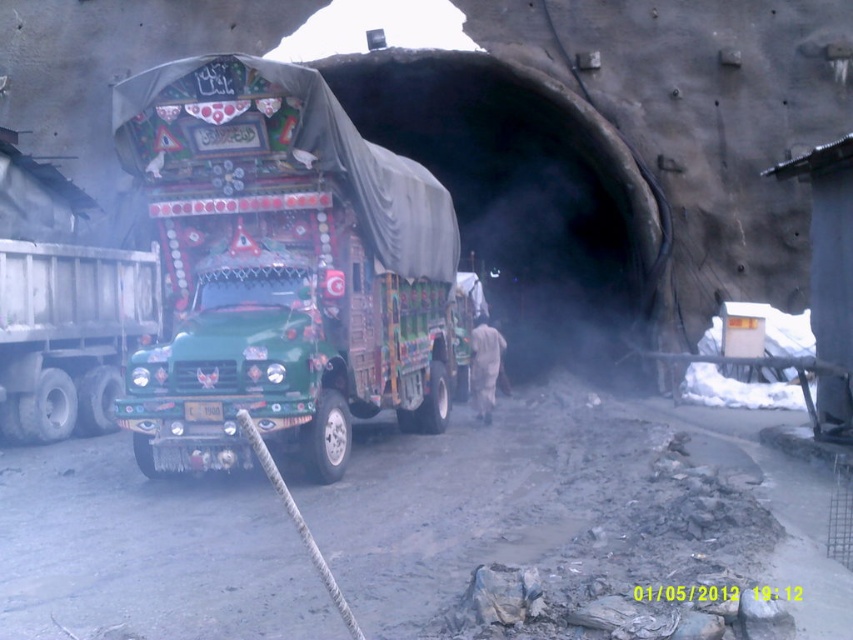
Find the location of a particular element. This screenshot has height=640, width=853. green painted truck at center is located at coordinates (281, 268).

Who is more distant from viewer, (128, 92) or (10, 426)?

Positioned behind is point (10, 426).

Image resolution: width=853 pixels, height=640 pixels. Identify the location of green painted truck at center. tap(281, 268).

Which is more to the right, dark concrete tunnel at center or green matte trailer truck at left?

A: From the viewer's perspective, dark concrete tunnel at center appears more on the right side.

Consider the image. Is dark concrete tunnel at center below green matte trailer truck at left?

Incorrect, dark concrete tunnel at center is not positioned below green matte trailer truck at left.

Which is behind, point (373, 129) or point (41, 342)?

The point (373, 129) is more distant.

Identify the location of dark concrete tunnel at center. This screenshot has width=853, height=640. (526, 198).

Is green painted truck at center to the left of dark concrete tunnel at center from the viewer's perspective?

Yes, green painted truck at center is to the left of dark concrete tunnel at center.

Who is shorter, green painted truck at center or dark concrete tunnel at center?

Standing shorter between the two is green painted truck at center.

Is point (210, 81) positioned after point (578, 161)?

That is False.

Find the location of `green painted truck at center`. green painted truck at center is located at coordinates (281, 268).